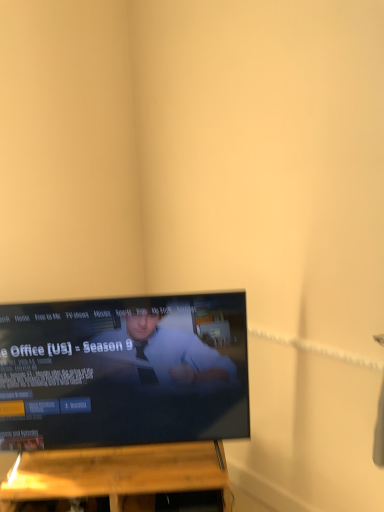
Question: Is wooden shelf at lower center bigger or smaller than black glossy tv at center?

Choices:
 (A) big
 (B) small

Answer: (B)

Question: Is wooden shelf at lower center taller or shorter than black glossy tv at center?

Choices:
 (A) tall
 (B) short

Answer: (B)

Question: From a real-world perspective, is wooden shelf at lower center positioned above or below black glossy tv at center?

Choices:
 (A) above
 (B) below

Answer: (B)

Question: Considering the relative positions of black glossy tv at center and wooden shelf at lower center in the image provided, is black glossy tv at center to the left or to the right of wooden shelf at lower center?

Choices:
 (A) left
 (B) right

Answer: (A)

Question: In terms of width, does black glossy tv at center look wider or thinner when compared to wooden shelf at lower center?

Choices:
 (A) wide
 (B) thin

Answer: (B)

Question: Is black glossy tv at center inside the boundaries of wooden shelf at lower center, or outside?

Choices:
 (A) inside
 (B) outside

Answer: (B)

Question: Is point (190, 329) closer or farther from the camera than point (99, 483)?

Choices:
 (A) closer
 (B) farther

Answer: (B)